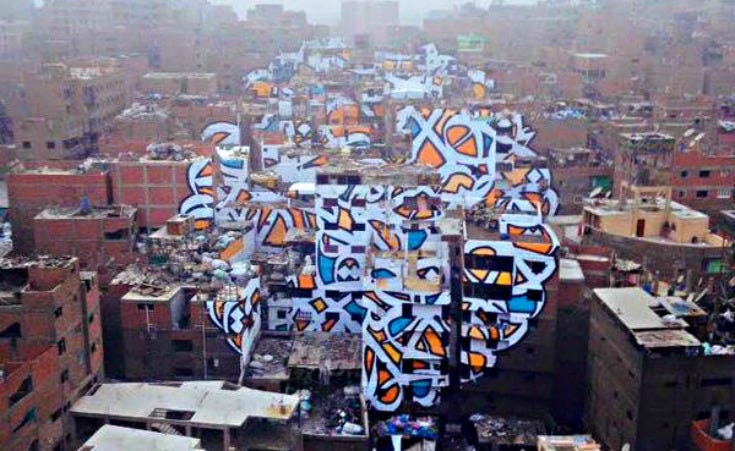
Find the location of a particular element. Image resolution: width=735 pixels, height=451 pixels. green wall is located at coordinates (476, 46).